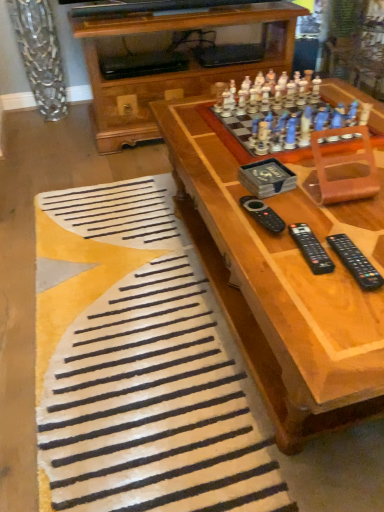
The width and height of the screenshot is (384, 512). I want to click on vacant space positioned to the left of black plastic remote at lower right, which ranks as the second remote in left-to-right order, so click(x=256, y=246).